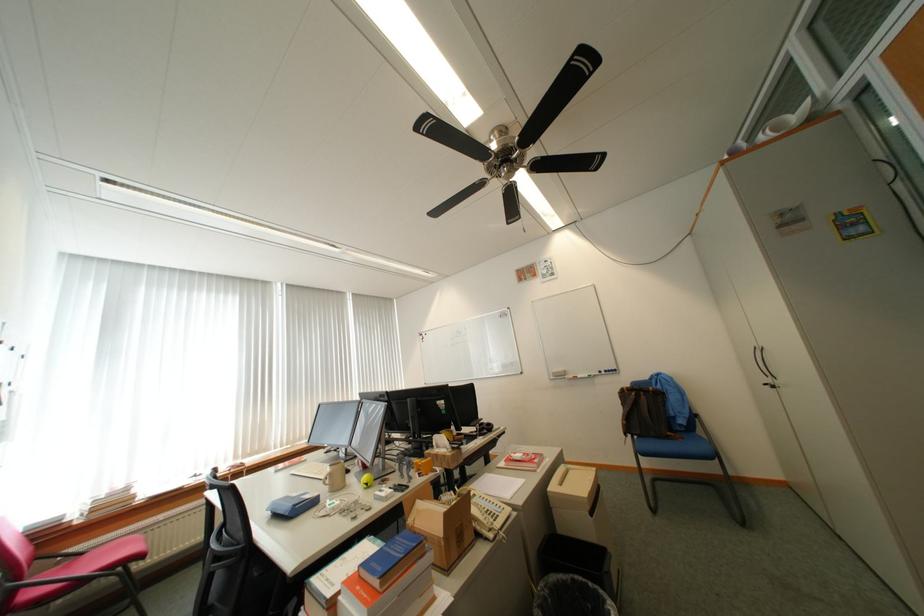
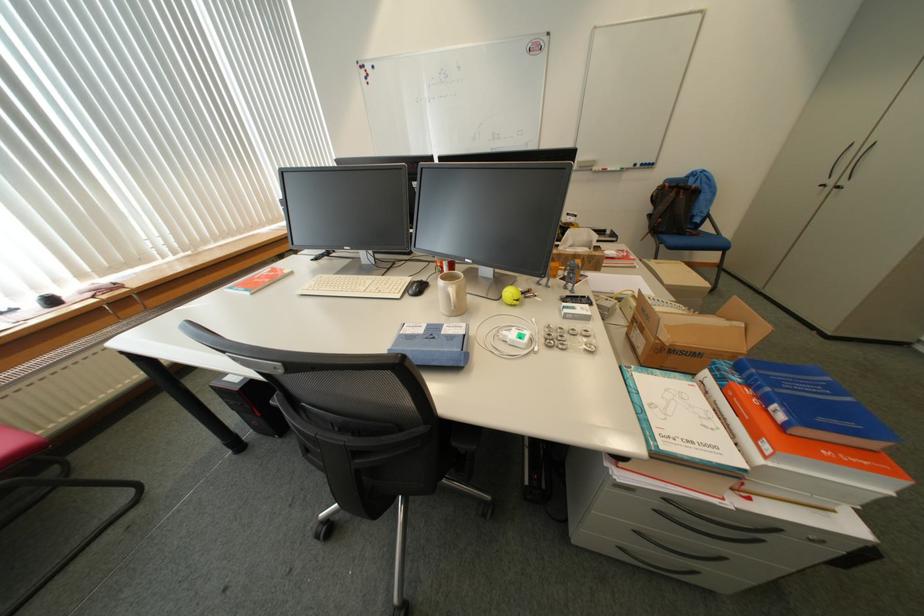
Find the pixel in the second image that matches pixel 331 503 in the first image.

(481, 334)